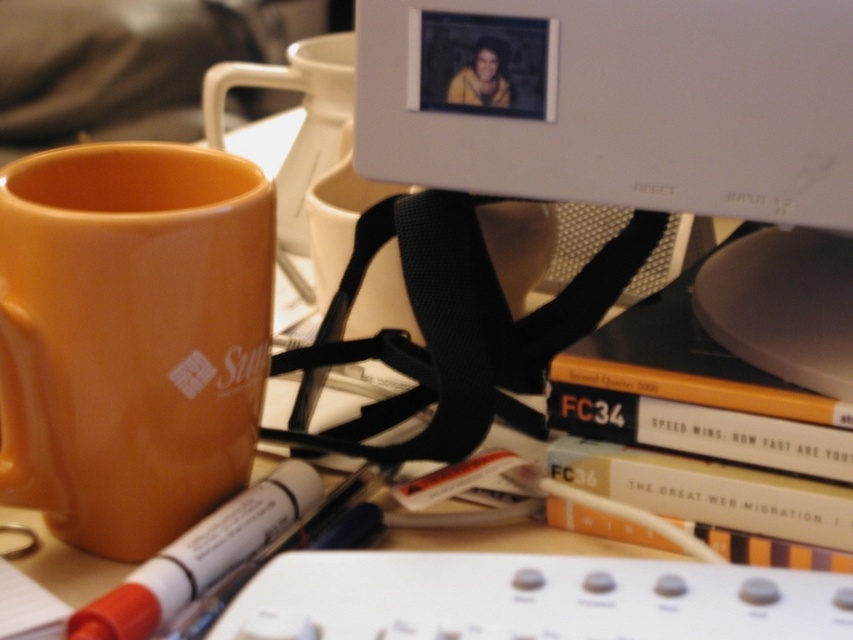
Question: Which point is closer to the camera?

Choices:
 (A) (231, 340)
 (B) (850, 540)
 (C) (167, 554)
 (D) (532, 131)

Answer: (C)

Question: Is matte orange mug at left bigger than hardcover book at center?

Choices:
 (A) yes
 (B) no

Answer: (A)

Question: Is white matte computer monitor at upper center wider than white matte marker at lower left?

Choices:
 (A) no
 (B) yes

Answer: (B)

Question: Which point is farther from the camera taking this photo?

Choices:
 (A) (90, 609)
 (B) (175, 273)
 (C) (628, 502)
 (D) (779, 209)

Answer: (C)

Question: Can you confirm if hardcover book at center is thinner than white matte marker at lower left?

Choices:
 (A) yes
 (B) no

Answer: (B)

Question: Which object is closer to the camera taking this photo?

Choices:
 (A) hardcover book at center
 (B) white matte computer monitor at upper center
 (C) white matte marker at lower left
 (D) matte orange mug at left

Answer: (C)